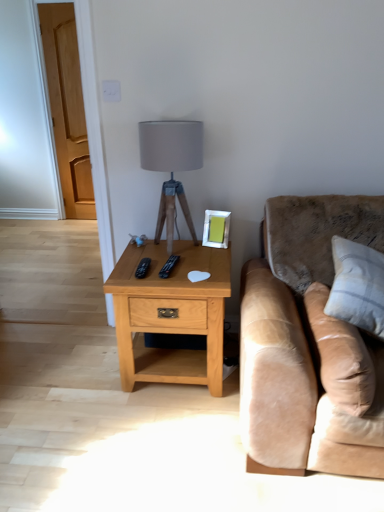
Question: Can you confirm if white cotton pillow at right, which is the second pillow in left-to-right order, is bigger than beige leather pillow at right, arranged as the 2th pillow when viewed from the right?

Choices:
 (A) yes
 (B) no

Answer: (A)

Question: Considering the relative sizes of white cotton pillow at right, which is counted as the 1th pillow, starting from the right, and beige leather pillow at right, which is the first pillow in left-to-right order, in the image provided, is white cotton pillow at right, which is counted as the 1th pillow, starting from the right, shorter than beige leather pillow at right, which is the first pillow in left-to-right order,?

Choices:
 (A) yes
 (B) no

Answer: (B)

Question: Is white cotton pillow at right, which is the second pillow in left-to-right order, facing away from beige leather pillow at right, which is the first pillow in left-to-right order?

Choices:
 (A) yes
 (B) no

Answer: (B)

Question: Would you say white cotton pillow at right, which is the second pillow in left-to-right order, is outside beige leather pillow at right, arranged as the 2th pillow when viewed from the right?

Choices:
 (A) yes
 (B) no

Answer: (A)

Question: From a real-world perspective, is white cotton pillow at right, which is the second pillow in left-to-right order, physically below beige leather pillow at right, which is the first pillow in left-to-right order?

Choices:
 (A) no
 (B) yes

Answer: (A)

Question: From the image's perspective, would you say white cotton pillow at right, which is counted as the 1th pillow, starting from the right, is shown under beige leather pillow at right, which is the first pillow in left-to-right order?

Choices:
 (A) no
 (B) yes

Answer: (A)

Question: Does silver metallic picture frame at upper right have a greater height compared to suede beige couch at right?

Choices:
 (A) yes
 (B) no

Answer: (B)

Question: Is silver metallic picture frame at upper right not close to suede beige couch at right?

Choices:
 (A) no
 (B) yes

Answer: (A)

Question: Is the depth of silver metallic picture frame at upper right less than that of suede beige couch at right?

Choices:
 (A) yes
 (B) no

Answer: (B)

Question: Is silver metallic picture frame at upper right shorter than suede beige couch at right?

Choices:
 (A) no
 (B) yes

Answer: (B)

Question: From the image's perspective, is silver metallic picture frame at upper right over suede beige couch at right?

Choices:
 (A) yes
 (B) no

Answer: (A)

Question: Is silver metallic picture frame at upper right to the right of suede beige couch at right from the viewer's perspective?

Choices:
 (A) yes
 (B) no

Answer: (B)

Question: Is matte gray fabric lampshade at center looking in the opposite direction of light oak wood nightstand at center?

Choices:
 (A) no
 (B) yes

Answer: (A)